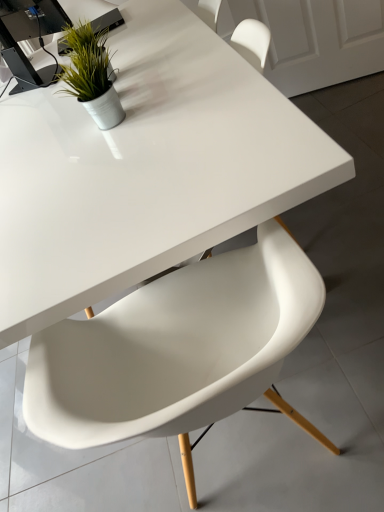
Find the location of `vacant point to the right of green matte plant at upper left`. vacant point to the right of green matte plant at upper left is located at coordinates (137, 57).